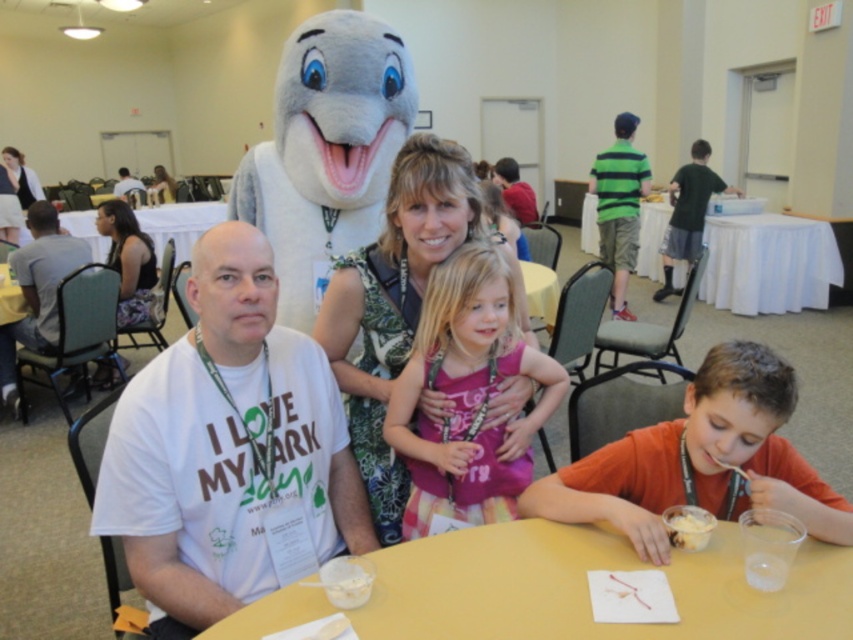
Who is higher up, pink fabric dress at center or white t-shirt at center?

Positioned higher is white t-shirt at center.

You are a GUI agent. You are given a task and a screenshot of the screen. Output one action in this format:
    pyautogui.click(x=<x>, y=<y>)
    Task: Click on the pink fabric dress at center
    
    Given the screenshot: What is the action you would take?
    pyautogui.click(x=467, y=396)

Is white plastic table at center positioned behind white creamy dessert at lower right?

Yes.

Does white plastic table at center appear under white creamy dessert at lower right?

Actually, white plastic table at center is above white creamy dessert at lower right.

Which is in front, point (102, 257) or point (695, 548)?

Point (695, 548)

You are a GUI agent. You are given a task and a screenshot of the screen. Output one action in this format:
    pyautogui.click(x=<x>, y=<y>)
    Task: Click on the white plastic table at center
    This screenshot has width=853, height=640.
    Given the screenshot: What is the action you would take?
    tap(178, 225)

Is white cloth-covered table at center to the left of white t-shirt at left from the viewer's perspective?

Incorrect, white cloth-covered table at center is not on the left side of white t-shirt at left.

The width and height of the screenshot is (853, 640). Find the location of `white cloth-covered table at center`. white cloth-covered table at center is located at coordinates (769, 262).

This screenshot has height=640, width=853. Find the location of `white cloth-covered table at center`. white cloth-covered table at center is located at coordinates (769, 262).